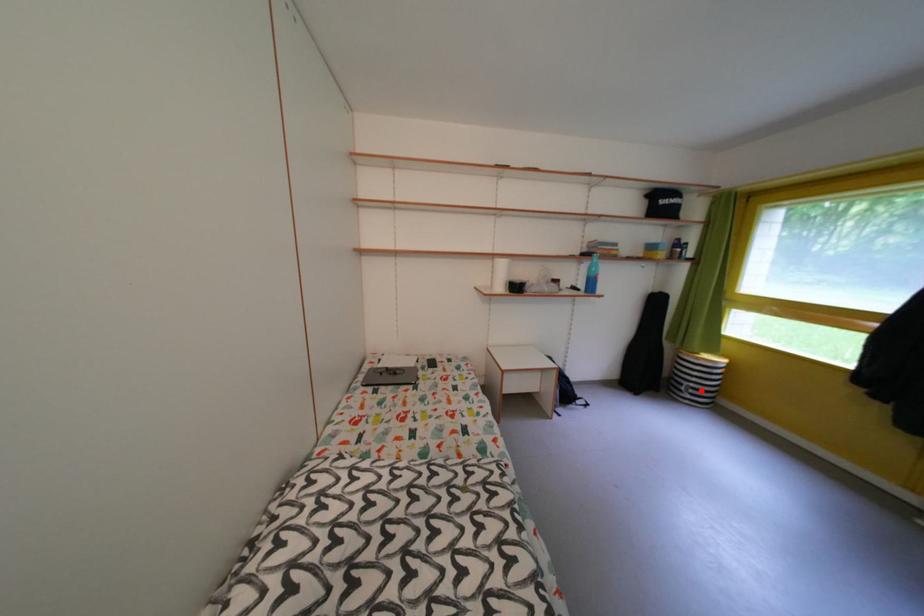
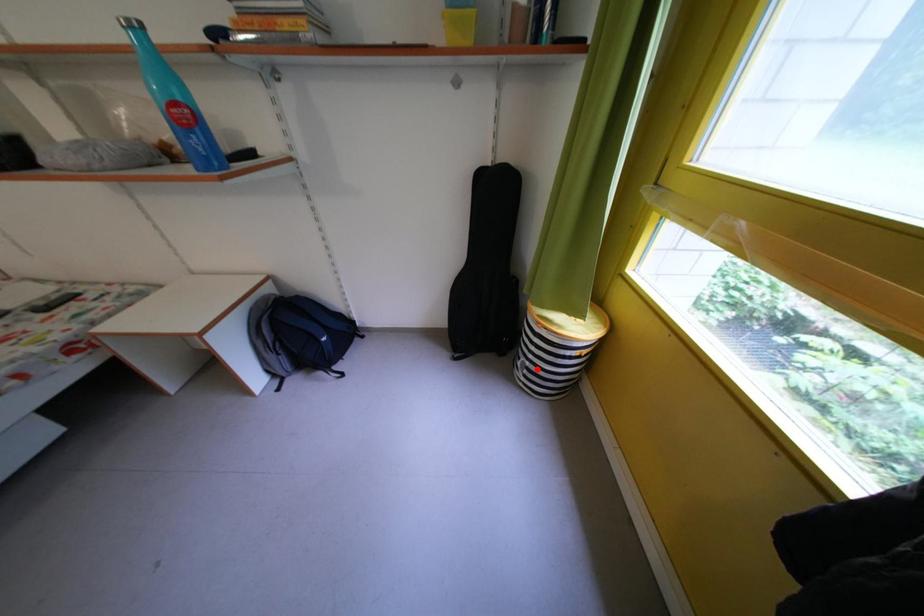
I am providing you with two images of the same scene from different viewpoints. A red point is marked on the first image and another point is marked on the second image. Are the points marked in image1 and image2 representing the same 3D position?

Yes